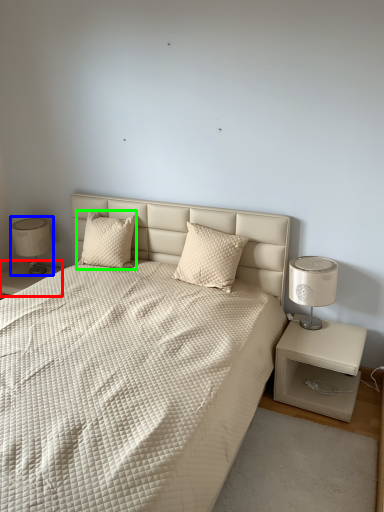
Question: Which object is the farthest from nightstand (highlighted by a red box)? Choose among these: table lamp (highlighted by a blue box) or pillow (highlighted by a green box).

Choices:
 (A) table lamp
 (B) pillow

Answer: (B)